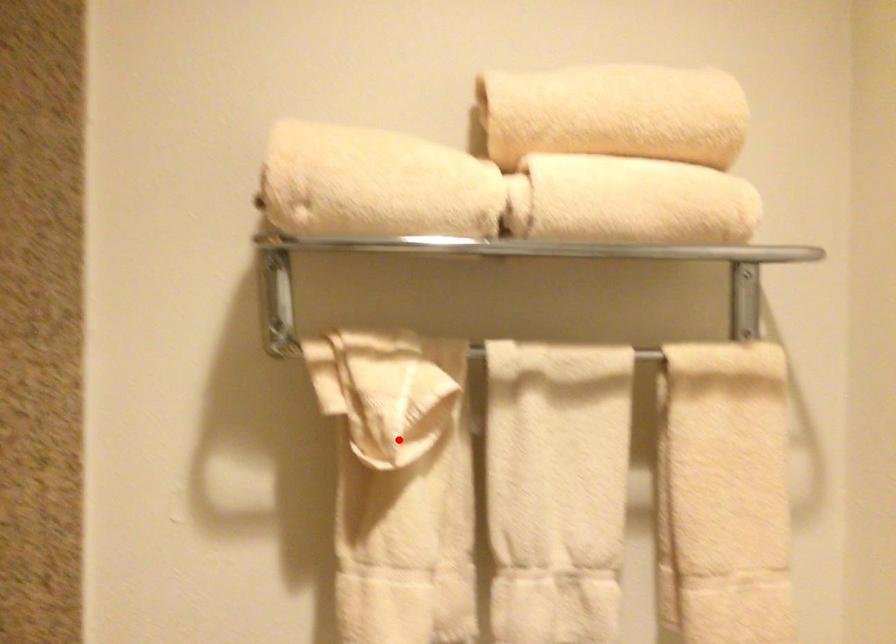
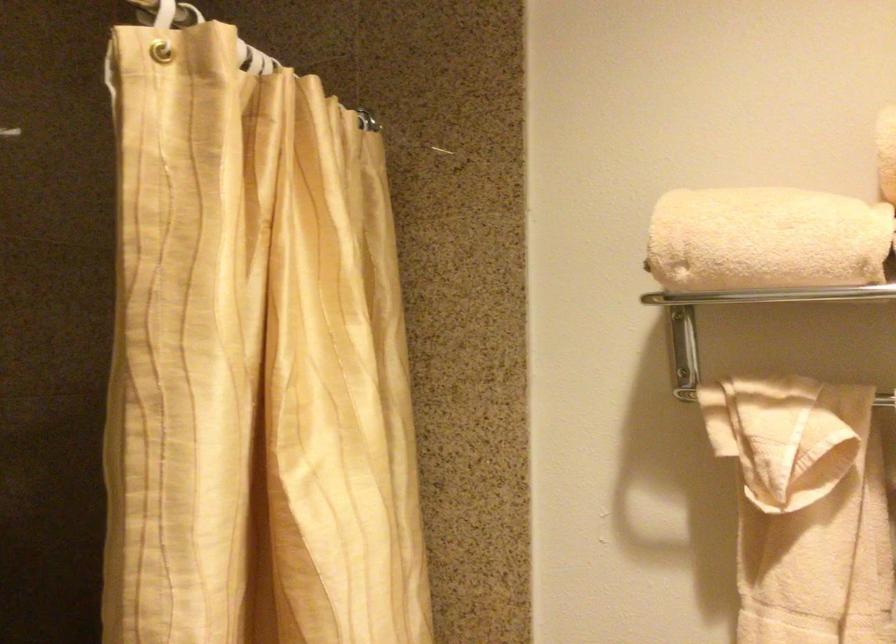
Find the pixel in the second image that matches the highlighted location in the first image.

(793, 486)